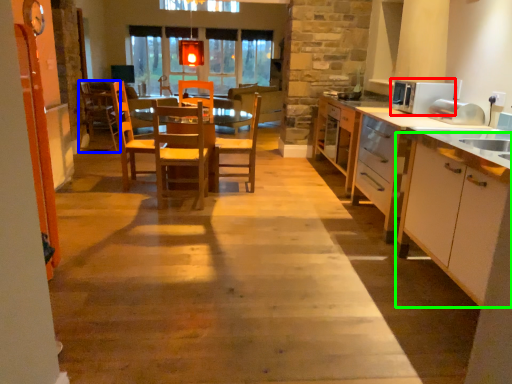
Question: Considering the real-world distances, which object is closest to appliance (highlighted by a red box)? chair (highlighted by a blue box) or cabinetry (highlighted by a green box).

Choices:
 (A) chair
 (B) cabinetry

Answer: (B)